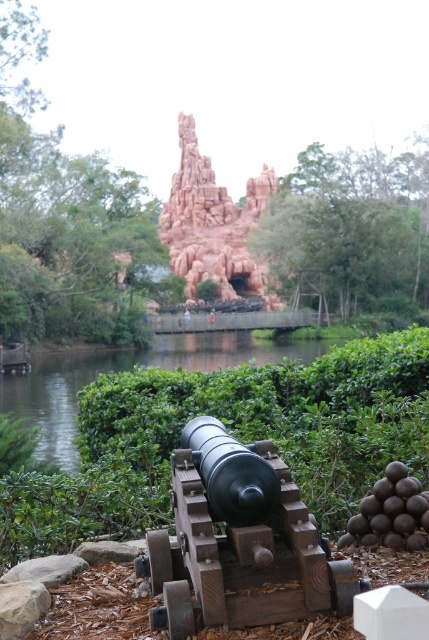
Between point (241, 378) and point (265, 538), which one is positioned in front?

Point (265, 538)

Between green leafy bush at center and wooden cannon at center, which one appears on the right side from the viewer's perspective?

From the viewer's perspective, green leafy bush at center appears more on the right side.

The width and height of the screenshot is (429, 640). What are the coordinates of `green leafy bush at center` in the screenshot? It's located at (230, 433).

Between green leafy bush at center and reddish-brown stone rock formation at center, which one has more height?

reddish-brown stone rock formation at center

Is the position of green leafy bush at center less distant than that of reddish-brown stone rock formation at center?

Yes, green leafy bush at center is in front of reddish-brown stone rock formation at center.

The image size is (429, 640). What do you see at coordinates (230, 433) in the screenshot?
I see `green leafy bush at center` at bounding box center [230, 433].

Locate an element on the screen. The image size is (429, 640). green leafy bush at center is located at coordinates (230, 433).

Who is shorter, wooden cannon at center or reddish-brown stone rock formation at center?

With less height is wooden cannon at center.

Between point (259, 516) and point (248, 291), which one is positioned in front?

Positioned in front is point (259, 516).

Which is in front, point (166, 570) or point (275, 189)?

Point (166, 570) is more forward.

Identify the location of wooden cannon at center. (238, 540).